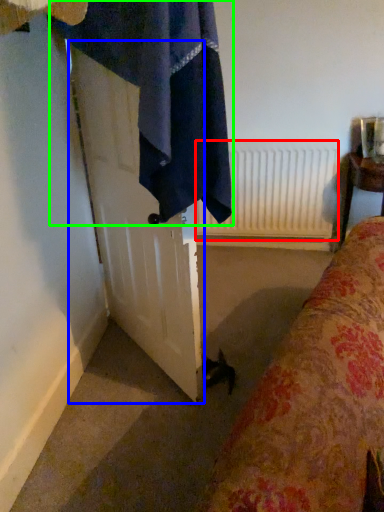
Question: Which object is the farthest from radiator (highlighted by a red box)? Choose among these: screen door (highlighted by a blue box) or bath towel (highlighted by a green box).

Choices:
 (A) screen door
 (B) bath towel

Answer: (B)